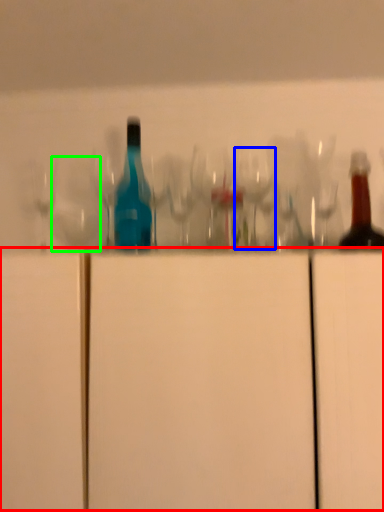
Question: Which object is positioned closest to cabinetry (highlighted by a red box)? Select from wine glass (highlighted by a blue box) and shot glass (highlighted by a green box).

Choices:
 (A) wine glass
 (B) shot glass

Answer: (A)